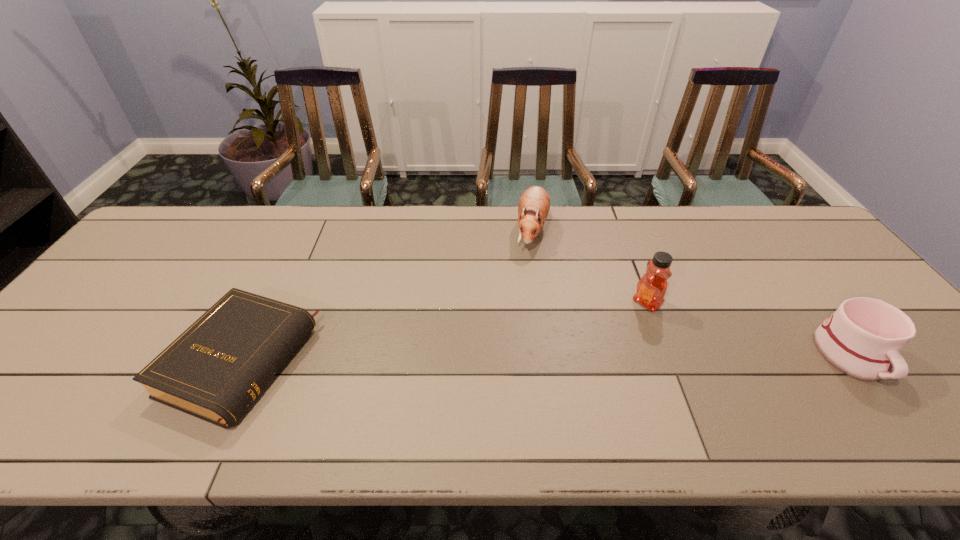
Locate an element on the screen. vacant area at the right edge is located at coordinates (800, 265).

Where is `vacant position at the far left corner of the desktop`? This screenshot has width=960, height=540. vacant position at the far left corner of the desktop is located at coordinates (153, 241).

This screenshot has width=960, height=540. Find the location of `vacant area that lies between the honey and the hamster`. vacant area that lies between the honey and the hamster is located at coordinates (589, 267).

Where is `vacant area between the leftmost object and the third object from right to left`? This screenshot has width=960, height=540. vacant area between the leftmost object and the third object from right to left is located at coordinates (386, 296).

The width and height of the screenshot is (960, 540). Find the location of `vacant area between the Bible and the honey`. vacant area between the Bible and the honey is located at coordinates (444, 333).

The width and height of the screenshot is (960, 540). Find the location of `vacant area that lies between the second object from right to left and the shortest object`. vacant area that lies between the second object from right to left and the shortest object is located at coordinates (444, 333).

Identify the location of free spot between the Bible and the rightmost object. (546, 360).

At what (x,y) coordinates should I click in order to perform the action: click on free area in between the shortest object and the hamster. Please return your answer as a coordinate pair (x, y). Looking at the image, I should click on (x=386, y=296).

Where is `free space that is in between the mug and the Bible`? free space that is in between the mug and the Bible is located at coordinates (546, 360).

The height and width of the screenshot is (540, 960). Identify the location of vacant space in between the leftmost object and the hamster. (386, 296).